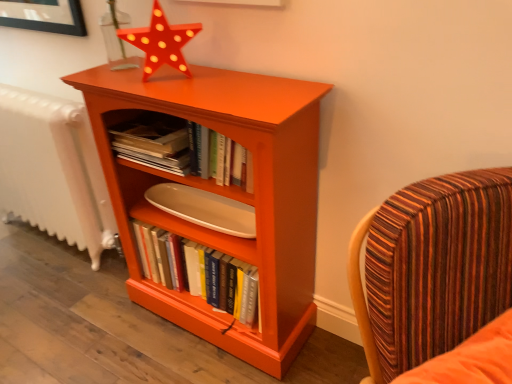
Question: Is matte orange shelf at center smaller than orange matte wood bookcase at center?

Choices:
 (A) no
 (B) yes

Answer: (B)

Question: From the image's perspective, is matte orange shelf at center below orange matte wood bookcase at center?

Choices:
 (A) yes
 (B) no

Answer: (B)

Question: Is matte orange shelf at center positioned behind orange matte wood bookcase at center?

Choices:
 (A) yes
 (B) no

Answer: (A)

Question: Does matte orange shelf at center lie in front of orange matte wood bookcase at center?

Choices:
 (A) yes
 (B) no

Answer: (B)

Question: Is matte orange shelf at center beside orange matte wood bookcase at center?

Choices:
 (A) yes
 (B) no

Answer: (B)

Question: From a real-world perspective, is striped fabric chair at right physically located above or below matte orange shelf at center?

Choices:
 (A) above
 (B) below

Answer: (B)

Question: From the image's perspective, relative to matte orange shelf at center, is striped fabric chair at right above or below?

Choices:
 (A) above
 (B) below

Answer: (B)

Question: In terms of width, does striped fabric chair at right look wider or thinner when compared to matte orange shelf at center?

Choices:
 (A) wide
 (B) thin

Answer: (A)

Question: Considering their positions, is striped fabric chair at right located in front of or behind matte orange shelf at center?

Choices:
 (A) behind
 (B) front

Answer: (B)

Question: In terms of height, does white textured radiator at left look taller or shorter compared to matte orange star at upper center?

Choices:
 (A) tall
 (B) short

Answer: (A)

Question: In terms of size, does white textured radiator at left appear bigger or smaller than matte orange star at upper center?

Choices:
 (A) small
 (B) big

Answer: (B)

Question: From the image's perspective, relative to matte orange star at upper center, is white textured radiator at left above or below?

Choices:
 (A) above
 (B) below

Answer: (B)

Question: From a real-world perspective, is white textured radiator at left positioned above or below matte orange star at upper center?

Choices:
 (A) above
 (B) below

Answer: (B)

Question: Does point (268, 369) appear closer or farther from the camera than point (95, 198)?

Choices:
 (A) closer
 (B) farther

Answer: (A)

Question: Do you think orange matte wood bookcase at center is within white textured radiator at left, or outside of it?

Choices:
 (A) inside
 (B) outside

Answer: (B)